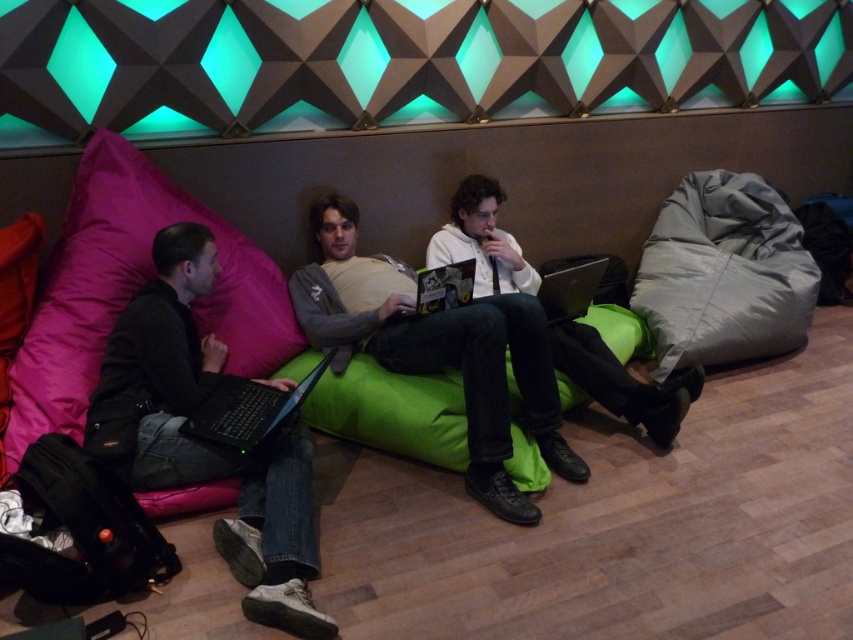
You are standing at the origin point in the image. Which direction should you move to reach the gray matte bean bag chair at right?

The gray matte bean bag chair at right is located at coordinates point 0.428 on the x axis and 0.850 on the y axis. Since you are at the origin point, you should move to the right along the x axis and upwards along the y axis to reach it.

You are a person who wants to place a matte black laptop at center on top of the gray matte bean bag chair at right. Is the laptop able to be placed there without falling off?

The gray matte bean bag chair at right has a greater height compared to matte black laptop at center, so the laptop can be placed on top without falling off as the bean bag provides a stable surface.

You are organizing a study session and need to place a notebook between the matte black laptop at left and the pink fabric pillow at left. Given that the notebook is 10 inches wide, can it fit between them if the space between the two objects is exactly the width of the wider object?

The pink fabric pillow at left is wider than the matte black laptop at left. Since the space between them is the width of the wider object, which is the pink fabric pillow at left, and the notebook is 10 inches wide, it depends on the actual width of the pillow. However, the description only states the laptop is narrower, not the exact measurements. Without specific dimensions, we cannot confirm if the notebook will fit.